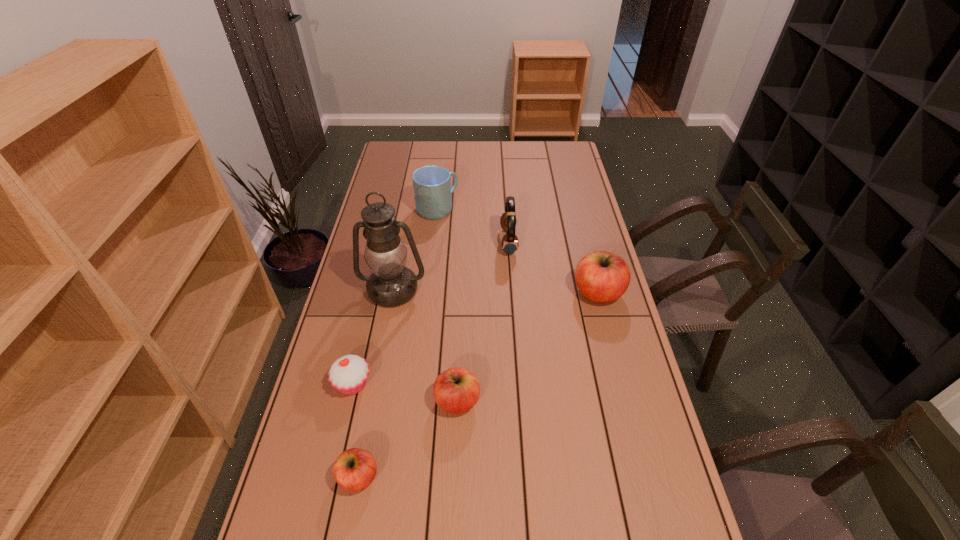
Select which apple appears as the third closest to the farthest object. Please provide its 2D coordinates. Your answer should be formatted as a tuple, i.e. [(x, y)], where the tuple contains the x and y coordinates of a point satisfying the conditions above.

[(354, 469)]

Image resolution: width=960 pixels, height=540 pixels. Find the location of `vacant space that satisfies the following two spatial constraints: 1. on the ear cup of the sixth object from left to right; 2. on the front side of the cupcake`. vacant space that satisfies the following two spatial constraints: 1. on the ear cup of the sixth object from left to right; 2. on the front side of the cupcake is located at coordinates (518, 384).

Find the location of `vacant area that satisfies the following two spatial constraints: 1. on the front side of the farthest apple; 2. on the left side of the oil lamp`. vacant area that satisfies the following two spatial constraints: 1. on the front side of the farthest apple; 2. on the left side of the oil lamp is located at coordinates (393, 293).

Where is `blank space that satisfies the following two spatial constraints: 1. on the ear cup of the second object from right to left; 2. on the front side of the cupcake`? This screenshot has height=540, width=960. blank space that satisfies the following two spatial constraints: 1. on the ear cup of the second object from right to left; 2. on the front side of the cupcake is located at coordinates (518, 384).